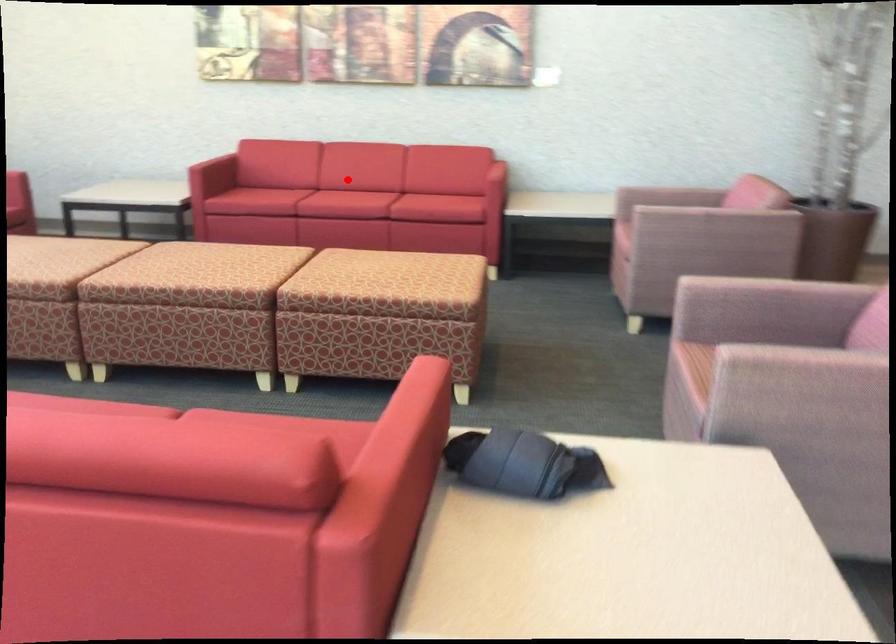
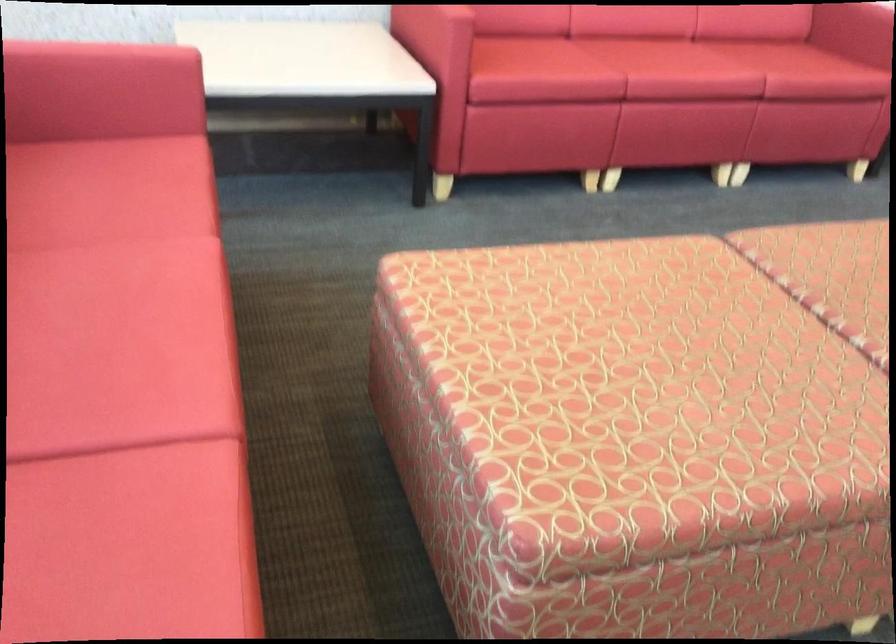
The point at the highlighted location is marked in the first image. Where is the corresponding point in the second image?

(677, 62)